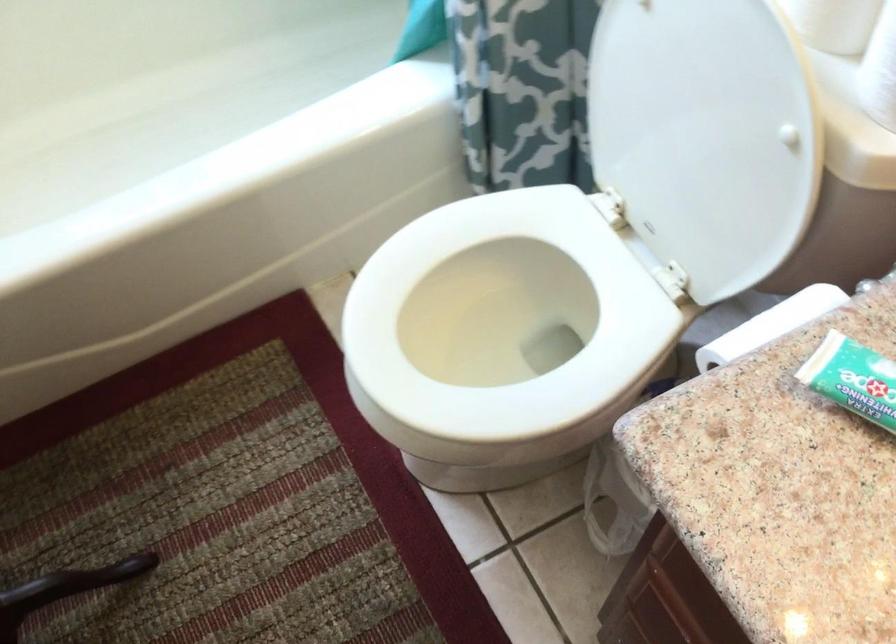
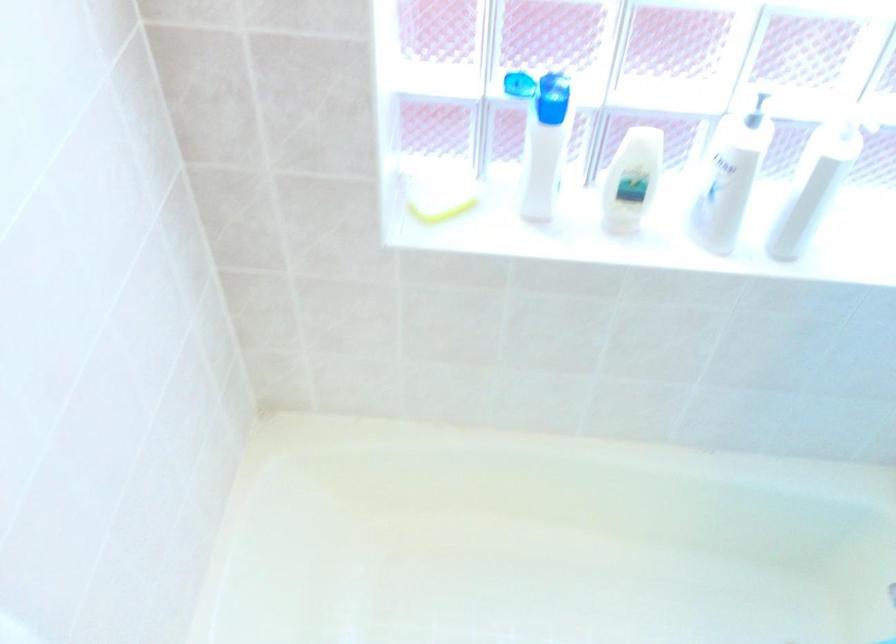
Question: How did the camera likely rotate?

Choices:
 (A) Left
 (B) Right
 (C) Up
 (D) Down

Answer: (A)